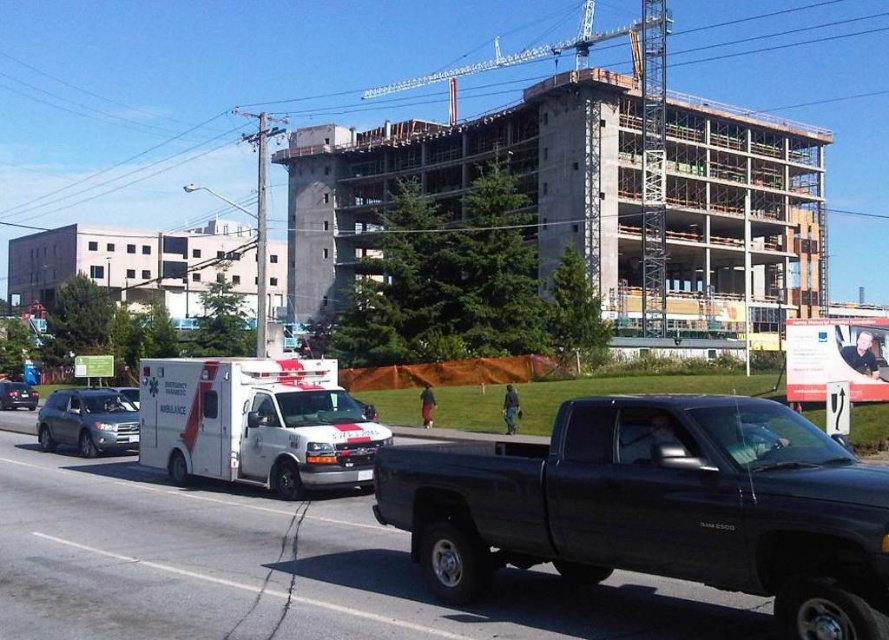
Which is in front, point (719, 502) or point (273, 390)?

Positioned in front is point (719, 502).

Is matte black pickup truck at center wider than white glossy ambulance at center?

In fact, matte black pickup truck at center might be narrower than white glossy ambulance at center.

This screenshot has width=889, height=640. Identify the location of matte black pickup truck at center. (657, 506).

At what (x,y) coordinates should I click in order to perform the action: click on matte black pickup truck at center. Please return your answer as a coordinate pair (x, y). Looking at the image, I should click on (657, 506).

Is concrete building at center smaller than white glossy ambulance at center?

Incorrect, concrete building at center is not smaller in size than white glossy ambulance at center.

Which is behind, point (735, 234) or point (219, 428)?

Point (735, 234)

Who is more distant from viewer, (666, 196) or (239, 460)?

The point (666, 196) is more distant.

Identify the location of concrete building at center. (470, 182).

Who is positioned more to the left, concrete building at center or matte gray suv at left?

matte gray suv at left is more to the left.

Is point (818, 262) closer to camera compared to point (79, 435)?

No.

The image size is (889, 640). I want to click on concrete building at center, so click(x=470, y=182).